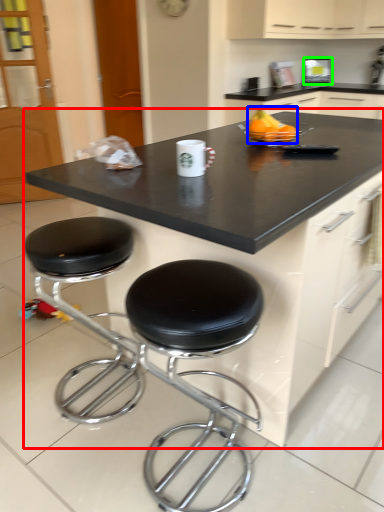
Question: Which object is the closest to the countertop (highlighted by a red box)? Choose among these: fruit (highlighted by a blue box) or appliance (highlighted by a green box).

Choices:
 (A) fruit
 (B) appliance

Answer: (A)